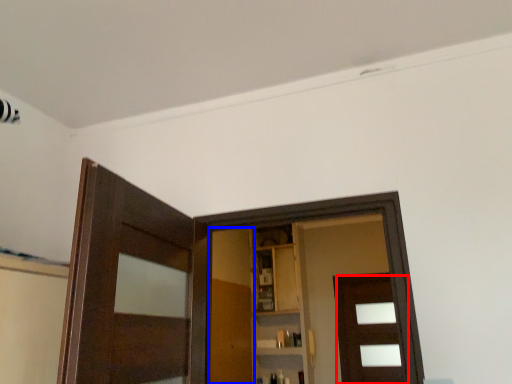
Question: Among these objects, which one is nearest to the camera, door (highlighted by a red box) or barn door (highlighted by a blue box)?

Choices:
 (A) door
 (B) barn door

Answer: (B)